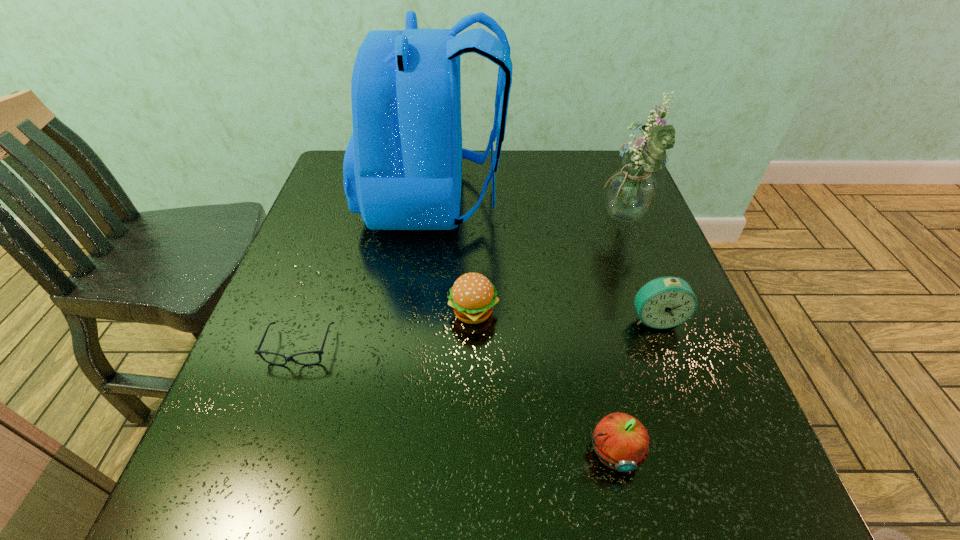
Where is `alarm clock present at the right edge`? alarm clock present at the right edge is located at coordinates click(665, 302).

This screenshot has height=540, width=960. I want to click on object located in the far left corner section of the desktop, so click(402, 168).

Identify the location of free space at the far edge of the desktop. The image size is (960, 540). (564, 173).

Find the location of a particular element. The image size is (960, 540). free space at the left edge of the desktop is located at coordinates (341, 222).

This screenshot has height=540, width=960. I want to click on free region at the right edge of the desktop, so (x=658, y=432).

This screenshot has width=960, height=540. Identify the location of blank space at the near left corner of the desktop. (236, 515).

Find the location of a particular element. This screenshot has width=960, height=540. vacant space at the near right corner of the desktop is located at coordinates (740, 491).

At what (x,y) coordinates should I click in order to perform the action: click on vacant point located between the nearest object and the second tallest object. Please return your answer as a coordinate pair (x, y). The height and width of the screenshot is (540, 960). Looking at the image, I should click on (618, 336).

Identify the location of vacant area between the hamburger and the tallest object. (454, 256).

You are a GUI agent. You are given a task and a screenshot of the screen. Output one action in this format:
    pyautogui.click(x=<x>, y=<y>)
    Task: Click on the free space between the spectacles and the hamburger
    This screenshot has width=960, height=540.
    Given the screenshot: What is the action you would take?
    pyautogui.click(x=387, y=330)